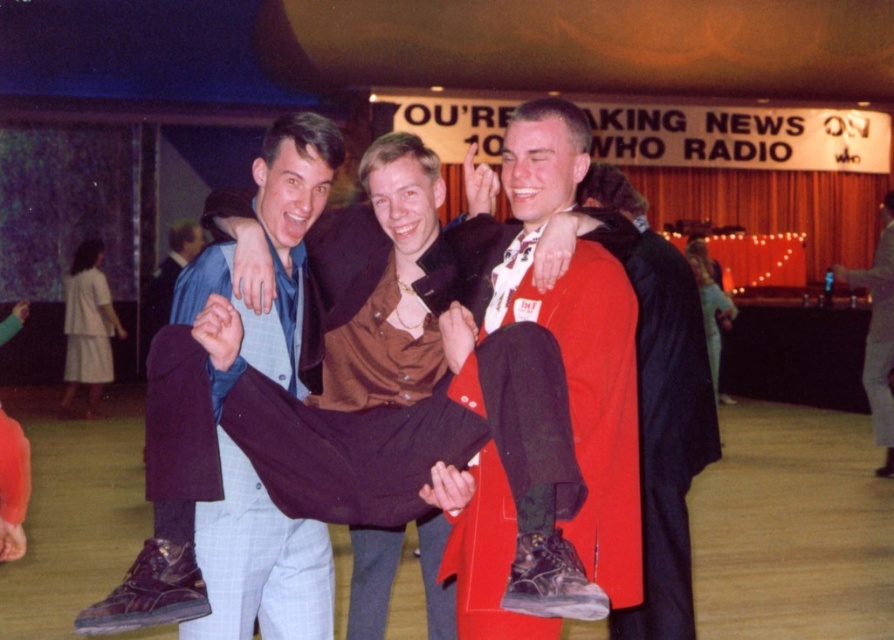
What do you see at coordinates (268, 256) in the screenshot? I see `light blue plaid pants at center` at bounding box center [268, 256].

Does light blue plaid pants at center have a larger size compared to brown leather jacket at center?

Correct, light blue plaid pants at center is larger in size than brown leather jacket at center.

Find the location of a particular element. This screenshot has height=640, width=894. light blue plaid pants at center is located at coordinates click(268, 256).